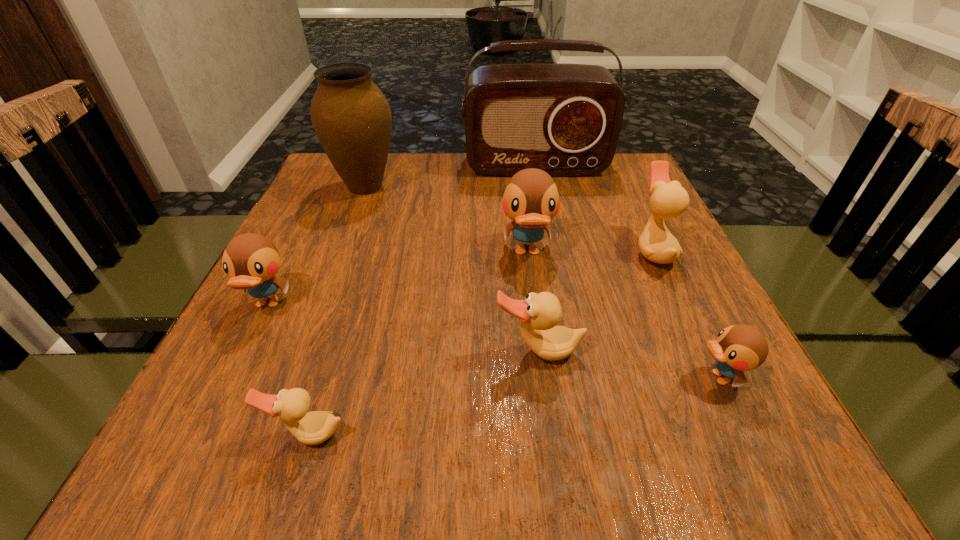
This screenshot has width=960, height=540. I want to click on free spot located on the front-facing side of the leftmost duck, so click(200, 441).

Where is `free space located 0.120m on the beak of the second nearest tan duck`? This screenshot has height=540, width=960. free space located 0.120m on the beak of the second nearest tan duck is located at coordinates (549, 437).

The image size is (960, 540). In order to click on vacant region located 0.370m on the front-facing side of the smallest blue duck in this screenshot , I will do `click(456, 377)`.

Where is `vacant space located on the front-facing side of the smallest blue duck`? This screenshot has width=960, height=540. vacant space located on the front-facing side of the smallest blue duck is located at coordinates (533, 377).

The height and width of the screenshot is (540, 960). I want to click on vacant space located on the front-facing side of the smallest blue duck, so click(468, 377).

Where is `radio receiver located in the far edge section of the desktop`? radio receiver located in the far edge section of the desktop is located at coordinates (565, 119).

Where is `urn that is at the far edge`? The width and height of the screenshot is (960, 540). urn that is at the far edge is located at coordinates (352, 118).

Find the location of a particular element. object located at the near edge is located at coordinates (311, 428).

I want to click on urn that is at the left edge, so click(x=352, y=118).

Locate an element on the screen. Image resolution: width=960 pixels, height=540 pixels. radio receiver that is at the right edge is located at coordinates (565, 119).